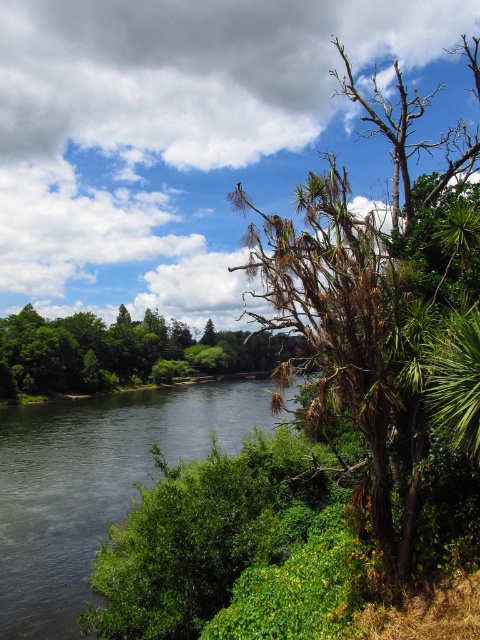
Locate an element on the screen. dark green water at center is located at coordinates (95, 483).

Does dark green water at center have a greater width compared to brown leafy tree at center?

In fact, dark green water at center might be narrower than brown leafy tree at center.

Which is in front, point (109, 456) or point (84, 353)?

Positioned in front is point (109, 456).

Locate an element on the screen. The height and width of the screenshot is (640, 480). dark green water at center is located at coordinates (95, 483).

Can you confirm if brown/dried wood tree at right is positioned to the right of brown leafy tree at center?

Correct, you'll find brown/dried wood tree at right to the right of brown leafy tree at center.

Can you confirm if brown/dried wood tree at right is wider than brown leafy tree at center?

Correct, the width of brown/dried wood tree at right exceeds that of brown leafy tree at center.

What do you see at coordinates (382, 308) in the screenshot? I see `brown/dried wood tree at right` at bounding box center [382, 308].

Locate an element on the screen. brown/dried wood tree at right is located at coordinates (382, 308).

Is brown/dried wood tree at right above dark green water at center?

Correct, brown/dried wood tree at right is located above dark green water at center.

Between point (454, 216) and point (121, 412), which one is positioned behind?

The point (121, 412) is more distant.

Is point (402, 262) in front of point (20, 500)?

Yes, it is.

What are the coordinates of `brown/dried wood tree at right` in the screenshot? It's located at (382, 308).